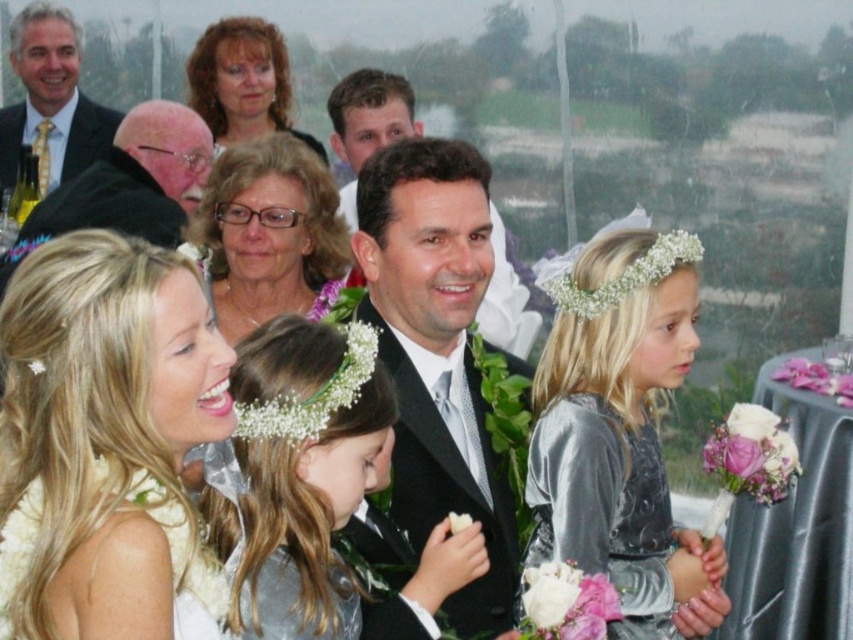
How much distance is there between silver metallic dress at center and white satin dress at lower left?

silver metallic dress at center and white satin dress at lower left are 35.65 centimeters apart from each other.

Which is more to the right, silver metallic dress at center or white satin dress at lower left?

silver metallic dress at center

Who is more distant from viewer, (357, 422) or (158, 509)?

The point (357, 422) is more distant.

Locate an element on the screen. silver metallic dress at center is located at coordinates (294, 472).

Can you confirm if shiny black suit at center is shorter than matte black suit at upper left?

Yes.

Does shiny black suit at center have a larger size compared to matte black suit at upper left?

No, shiny black suit at center is not bigger than matte black suit at upper left.

This screenshot has height=640, width=853. Describe the element at coordinates (437, 355) in the screenshot. I see `shiny black suit at center` at that location.

The height and width of the screenshot is (640, 853). What are the coordinates of `shiny black suit at center` in the screenshot? It's located at (437, 355).

Is point (590, 336) in front of point (380, 300)?

No, (590, 336) is further to viewer.

Can you confirm if satin silver dress at center is shorter than shiny black suit at center?

Indeed, satin silver dress at center has a lesser height compared to shiny black suit at center.

The height and width of the screenshot is (640, 853). I want to click on satin silver dress at center, so click(619, 442).

Where is `satin silver dress at center`? This screenshot has width=853, height=640. satin silver dress at center is located at coordinates coord(619,442).